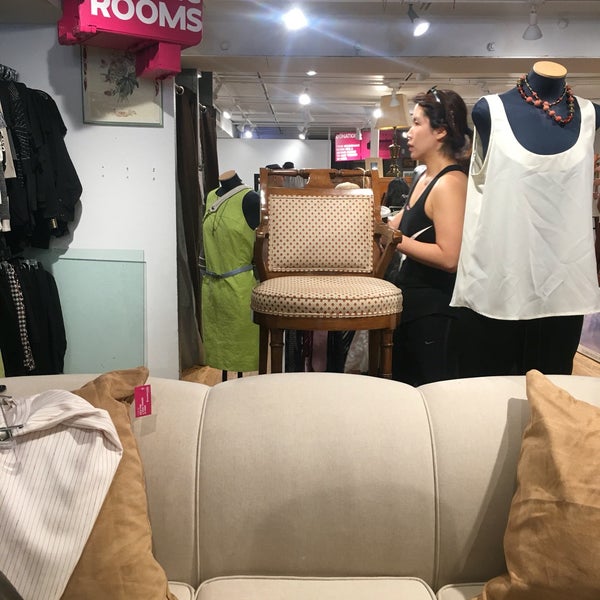
In order to click on high chair in this screenshot , I will do `click(327, 264)`.